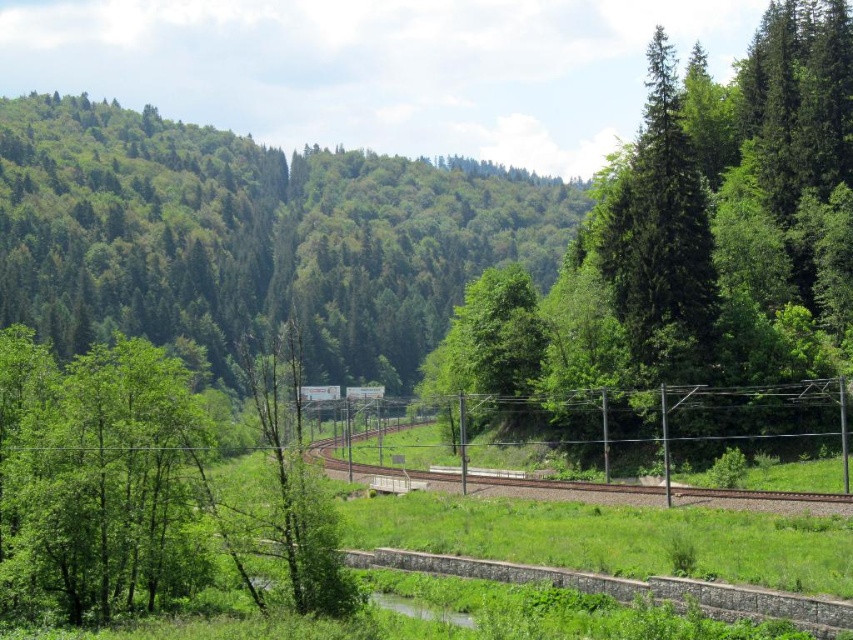
Question: Which point appears closest to the camera in this image?

Choices:
 (A) (18, 525)
 (B) (729, 408)
 (C) (459, 164)

Answer: (A)

Question: Which object appears farthest from the camera in this image?

Choices:
 (A) green textured tree at center
 (B) green leafy tree at left

Answer: (A)

Question: Is green textured tree at center thinner than green leafy tree at left?

Choices:
 (A) no
 (B) yes

Answer: (A)

Question: Observing the image, what is the correct spatial positioning of green textured tree at center in reference to metallic wire fence at center?

Choices:
 (A) below
 (B) above

Answer: (B)

Question: Is green leafy tree at left wider than metallic wire fence at center?

Choices:
 (A) yes
 (B) no

Answer: (B)

Question: Based on their relative distances, which object is nearer to the green leafy tree at left?

Choices:
 (A) green forested hillside at left
 (B) metallic wire fence at center

Answer: (B)